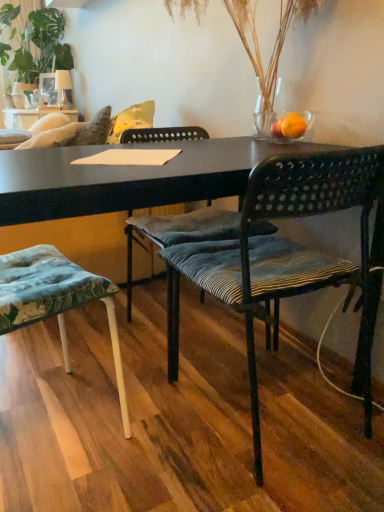
Find the location of a particular element. striped fabric chair at center, acting as the second chair starting from the right is located at coordinates (178, 233).

In order to face textured fabric cushion at lower left, which is the 1th chair from left to right, should I rotate leftwards or rightwards?

It's best to rotate left around 20.694 degrees.

This screenshot has height=512, width=384. What do you see at coordinates (55, 300) in the screenshot? I see `textured fabric cushion at lower left, acting as the third chair starting from the right` at bounding box center [55, 300].

Describe the element at coordinates (258, 42) in the screenshot. The image size is (384, 512). I see `clear glass vase at upper center` at that location.

The image size is (384, 512). In order to click on green leafy plant at upper left in this screenshot , I will do `click(35, 42)`.

Find the location of a particular element. This screenshot has height=512, width=384. orange matte glass at upper right is located at coordinates (293, 126).

Measure the distance between orange matte glass at upper right and camera.

orange matte glass at upper right and camera are 4.36 feet apart.

Where is `striped fabric chair at center, acting as the second chair starting from the right`? striped fabric chair at center, acting as the second chair starting from the right is located at coordinates click(178, 233).

Is textured fabric cushion at lower left, acting as the third chair starting from the right, oriented away from green leafy plant at upper left?

textured fabric cushion at lower left, acting as the third chair starting from the right, does not have its back to green leafy plant at upper left.

Considering the relative sizes of textured fabric cushion at lower left, which is the 1th chair from left to right, and green leafy plant at upper left in the image provided, is textured fabric cushion at lower left, which is the 1th chair from left to right, taller than green leafy plant at upper left?

No.

This screenshot has height=512, width=384. What are the coordinates of `the 3rd chair below the green leafy plant at upper left (from the image's perspective)` in the screenshot? It's located at (55, 300).

From a real-world perspective, is black woven chair at center, acting as the 3th chair starting from the left, on orange matte glass at upper right?

No, from a real-world perspective, black woven chair at center, acting as the 3th chair starting from the left, is not on top of orange matte glass at upper right.

Can you tell me how much black woven chair at center, acting as the 3th chair starting from the left, and orange matte glass at upper right differ in facing direction?

The angular difference between black woven chair at center, acting as the 3th chair starting from the left, and orange matte glass at upper right is 87.9 degrees.

From the picture: From the image's perspective, is black woven chair at center, the 1th chair when ordered from right to left, above or below orange matte glass at upper right?

black woven chair at center, the 1th chair when ordered from right to left, is situated lower than orange matte glass at upper right in the image.

Is the depth of black woven chair at center, the 1th chair when ordered from right to left, less than that of orange matte glass at upper right?

Yes, black woven chair at center, the 1th chair when ordered from right to left, is closer to the camera.

Does transparent glass bowl at upper right have a greater height compared to velvet green cushion at center?

Incorrect, the height of transparent glass bowl at upper right is not larger of that of velvet green cushion at center.

Is transparent glass bowl at upper right in front of or behind velvet green cushion at center in the image?

Visually, transparent glass bowl at upper right is located in front of velvet green cushion at center.

Is transparent glass bowl at upper right looking in the opposite direction of velvet green cushion at center?

No, transparent glass bowl at upper right's orientation is not away from velvet green cushion at center.

Looking at their sizes, would you say clear glass vase at upper center is wider or thinner than black woven chair at center, acting as the 3th chair starting from the left?

Clearly, clear glass vase at upper center has less width compared to black woven chair at center, acting as the 3th chair starting from the left.

From a real-world perspective, is clear glass vase at upper center on black woven chair at center, the 1th chair when ordered from right to left?

Yes, from a real-world perspective, clear glass vase at upper center is above black woven chair at center, the 1th chair when ordered from right to left.

Could you tell me if clear glass vase at upper center is turned towards black woven chair at center, acting as the 3th chair starting from the left?

No, clear glass vase at upper center is not aimed at black woven chair at center, acting as the 3th chair starting from the left.

Is clear glass vase at upper center smaller than black woven chair at center, the 1th chair when ordered from right to left?

Yes.

From a real-world perspective, does black woven chair at center, the 1th chair when ordered from right to left, stand above clear glass vase at upper center?

Actually, black woven chair at center, the 1th chair when ordered from right to left, is physically below clear glass vase at upper center in the real world.

Is black woven chair at center, the 1th chair when ordered from right to left, to the right of clear glass vase at upper center from the viewer's perspective?

No.

Is black woven chair at center, acting as the 3th chair starting from the left, aimed at clear glass vase at upper center?

No, black woven chair at center, acting as the 3th chair starting from the left, does not turn towards clear glass vase at upper center.

Does black woven chair at center, the 1th chair when ordered from right to left, lie behind transparent glass bowl at upper right?

No, the depth of black woven chair at center, the 1th chair when ordered from right to left, is less than that of transparent glass bowl at upper right.

How much distance is there between black woven chair at center, acting as the 3th chair starting from the left, and transparent glass bowl at upper right?

black woven chair at center, acting as the 3th chair starting from the left, and transparent glass bowl at upper right are 50.78 centimeters apart.

Is black woven chair at center, acting as the 3th chair starting from the left, taller or shorter than transparent glass bowl at upper right?

In the image, black woven chair at center, acting as the 3th chair starting from the left, appears to be taller than transparent glass bowl at upper right.

Based on the photo, how much distance is there between black woven chair at center, acting as the 3th chair starting from the left, and velvet green cushion at center?

black woven chair at center, acting as the 3th chair starting from the left, and velvet green cushion at center are 7.33 feet apart.

Which object is closer to the camera, black woven chair at center, acting as the 3th chair starting from the left, or velvet green cushion at center?

black woven chair at center, acting as the 3th chair starting from the left, is more forward.

Could you tell me if black woven chair at center, the 1th chair when ordered from right to left, is facing velvet green cushion at center?

Yes, black woven chair at center, the 1th chair when ordered from right to left, is facing velvet green cushion at center.

Considering the relative positions of black woven chair at center, acting as the 3th chair starting from the left, and velvet green cushion at center in the image provided, is black woven chair at center, acting as the 3th chair starting from the left, to the right of velvet green cushion at center from the viewer's perspective?

Yes.

The image size is (384, 512). Identify the location of houseplant behind the textured fabric cushion at lower left, acting as the third chair starting from the right. (35, 42).

From a real-world perspective, which chair is the 1st one underneath the orange matte glass at upper right? Please provide its 2D coordinates.

[(286, 254)]

Based on the photo, looking at the image, which one is located further to textured fabric cushion at lower left, which is the 1th chair from left to right, black woven chair at center, the 1th chair when ordered from right to left, or velvet green cushion at center?

The object further to textured fabric cushion at lower left, which is the 1th chair from left to right, is velvet green cushion at center.

When comparing their distances from clear glass vase at upper center, does textured fabric cushion at lower left, acting as the third chair starting from the right, or transparent glass bowl at upper right seem closer?

The object closer to clear glass vase at upper center is transparent glass bowl at upper right.

Estimate the real-world distances between objects in this image. Which object is further from clear glass vase at upper center, textured fabric cushion at lower left, acting as the third chair starting from the right, or velvet green cushion at center?

Among the two, velvet green cushion at center is located further to clear glass vase at upper center.

When comparing their distances from velvet green cushion at center, does orange matte glass at upper right or textured fabric cushion at lower left, which is the 1th chair from left to right, seem closer?

orange matte glass at upper right is positioned closer to the anchor velvet green cushion at center.

When comparing their distances from transparent glass bowl at upper right, does black woven chair at center, the 1th chair when ordered from right to left, or striped fabric chair at center, which is the second chair in left-to-right order, seem further?

black woven chair at center, the 1th chair when ordered from right to left, is further to transparent glass bowl at upper right.

Based on their spatial positions, is transparent glass bowl at upper right or black woven chair at center, acting as the 3th chair starting from the left, further from clear glass vase at upper center?

The object further to clear glass vase at upper center is black woven chair at center, acting as the 3th chair starting from the left.

When comparing their distances from clear glass vase at upper center, does black woven chair at center, acting as the 3th chair starting from the left, or textured fabric cushion at lower left, which is the 1th chair from left to right, seem further?

textured fabric cushion at lower left, which is the 1th chair from left to right, lies further to clear glass vase at upper center than the other object.

Consider the image. Looking at the image, which one is located closer to textured fabric cushion at lower left, which is the 1th chair from left to right, black woven chair at center, the 1th chair when ordered from right to left, or green leafy plant at upper left?

The object closer to textured fabric cushion at lower left, which is the 1th chair from left to right, is black woven chair at center, the 1th chair when ordered from right to left.

At what (x,y) coordinates should I click in order to perform the action: click on studio couch between striped fabric chair at center, which is the second chair in left-to-right order, and green leafy plant at upper left in the front-back direction. Please return your answer as a coordinate pair (x, y). The width and height of the screenshot is (384, 512). Looking at the image, I should click on (131, 120).

Identify the location of chair between clear glass vase at upper center and velvet green cushion at center in the front-back direction. (178, 233).

The width and height of the screenshot is (384, 512). I want to click on studio couch between clear glass vase at upper center and green leafy plant at upper left along the z-axis, so click(131, 120).

Locate an element on the screen. bowl positioned between clear glass vase at upper center and orange matte glass at upper right from near to far is located at coordinates (271, 127).